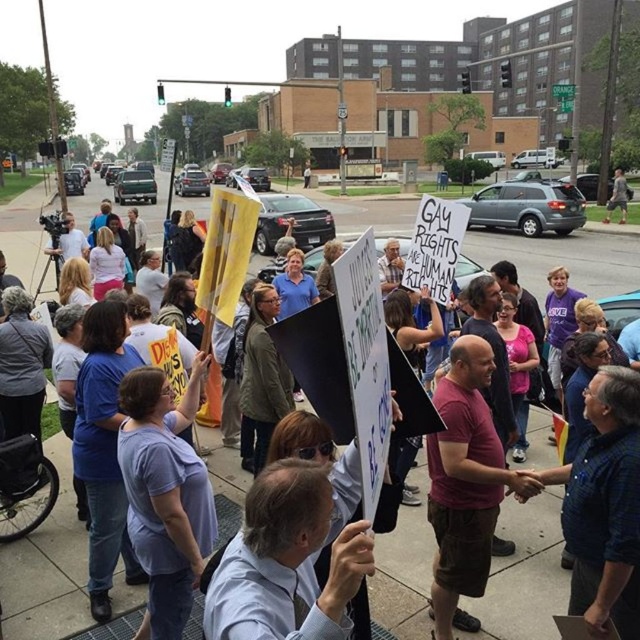
Question: Does concrete sidewalk at center appear under light purple t-shirt at center?

Choices:
 (A) yes
 (B) no

Answer: (B)

Question: Which of the following is the farthest from the observer?

Choices:
 (A) concrete sidewalk at center
 (B) light purple t-shirt at center

Answer: (A)

Question: Is concrete sidewalk at center below light purple t-shirt at center?

Choices:
 (A) yes
 (B) no

Answer: (B)

Question: Can you confirm if concrete sidewalk at center is positioned below light purple t-shirt at center?

Choices:
 (A) no
 (B) yes

Answer: (A)

Question: Which point is farther to the camera?

Choices:
 (A) light purple t-shirt at center
 (B) concrete sidewalk at center

Answer: (B)